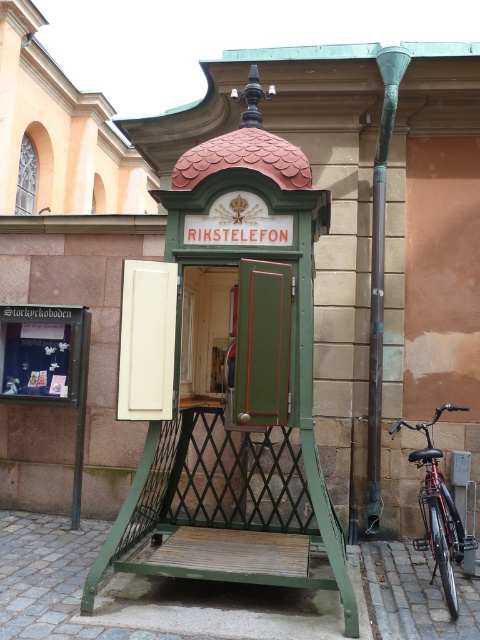
Which is more to the left, green wood telephone booth at center or green patinated metal pole at right?

green wood telephone booth at center

Does green wood telephone booth at center lie behind green patinated metal pole at right?

No, it is in front of green patinated metal pole at right.

You are a GUI agent. You are given a task and a screenshot of the screen. Output one action in this format:
    pyautogui.click(x=<x>, y=<y>)
    Task: Click on the green wood telephone booth at center
    The width and height of the screenshot is (480, 640).
    Given the screenshot: What is the action you would take?
    click(228, 376)

Locate an element on the screen. The image size is (480, 640). green wood telephone booth at center is located at coordinates (228, 376).

Is the position of green wood telephone booth at center less distant than that of shiny black bicycle at lower right?

Yes, green wood telephone booth at center is in front of shiny black bicycle at lower right.

Who is lower down, green wood telephone booth at center or shiny black bicycle at lower right?

shiny black bicycle at lower right

Is point (239, 308) less distant than point (463, 538)?

Yes, it is in front of point (463, 538).

Image resolution: width=480 pixels, height=640 pixels. I want to click on green wood telephone booth at center, so click(228, 376).

Is point (371, 365) positioned in front of point (447, 547)?

No, it is behind (447, 547).

I want to click on green patinated metal pole at right, so click(380, 275).